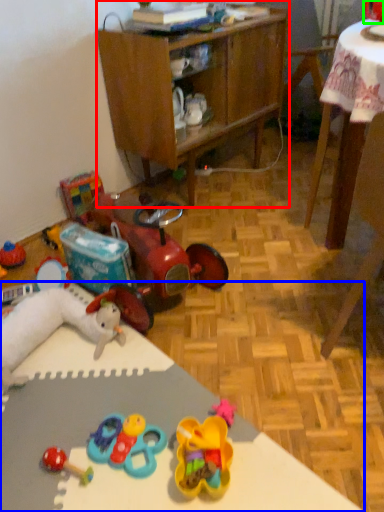
Question: Which object is the closest to the cabinetry (highlighted by a red box)? Choose among these: desk (highlighted by a blue box) or toy (highlighted by a green box).

Choices:
 (A) desk
 (B) toy

Answer: (B)